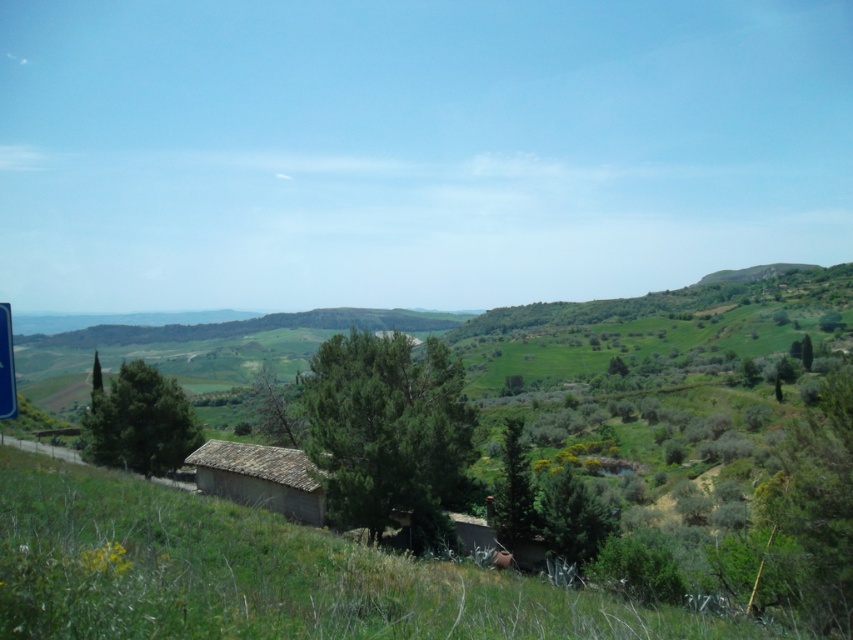
Question: Which of the following is the farthest from the observer?

Choices:
 (A) blue plastic sign at left
 (B) brown stone hut at center
 (C) green grassy at center

Answer: (B)

Question: Estimate the real-world distances between objects in this image. Which object is closer to the green grassy at center?

Choices:
 (A) brown stone hut at center
 (B) blue plastic sign at left

Answer: (B)

Question: Is brown stone hut at center below blue plastic sign at left?

Choices:
 (A) no
 (B) yes

Answer: (B)

Question: Does brown stone hut at center appear over blue plastic sign at left?

Choices:
 (A) yes
 (B) no

Answer: (B)

Question: Is brown stone hut at center positioned at the back of blue plastic sign at left?

Choices:
 (A) no
 (B) yes

Answer: (B)

Question: Which object is the farthest from the blue plastic sign at left?

Choices:
 (A) brown stone hut at center
 (B) green grassy at center

Answer: (A)